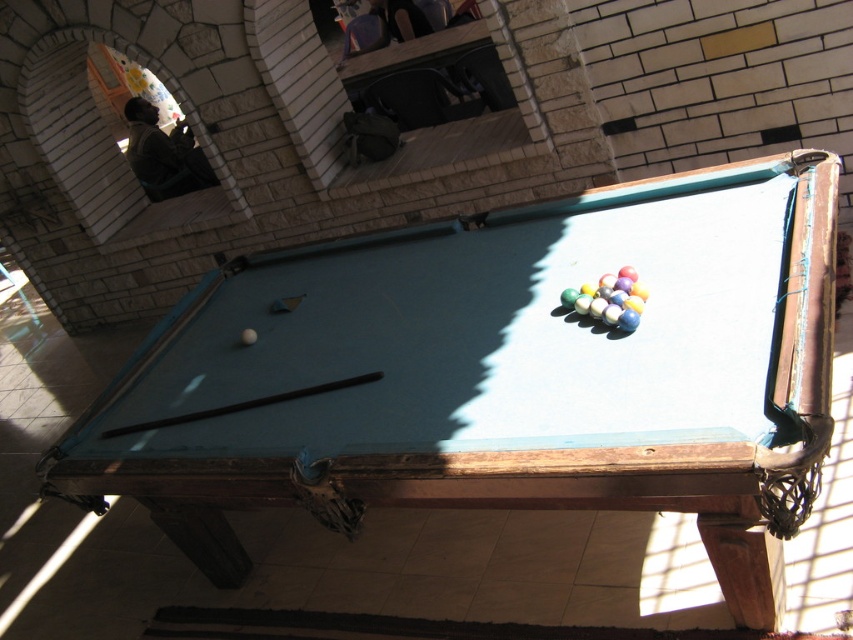
You are setting up a game room and want to place a new pool table and a cue rack. The current space has the blue felt pool table at center and the brown wood cue at center. Which object takes up more space in the room?

The blue felt pool table at center is bigger than the brown wood cue at center, so it takes up more space in the room.

Looking at this image, you are a delivery person who needs to place a package on the blue felt pool table at center without knocking over the brown wood cue at center. Can you safely place the package on the table?

The blue felt pool table at center has a greater height compared to brown wood cue at center, so placing the package on the table should be safe as the height difference won